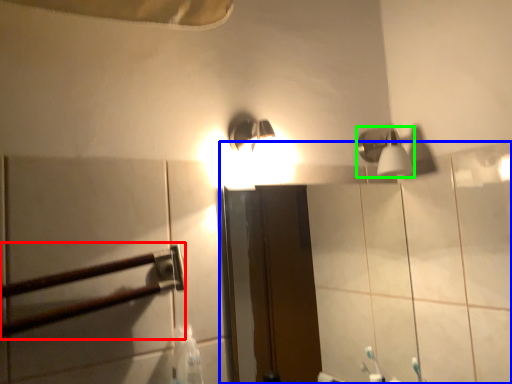
Question: Which object is the farthest from rail (highlighted by a red box)? Choose among these: mirror (highlighted by a blue box) or shower (highlighted by a green box).

Choices:
 (A) mirror
 (B) shower

Answer: (A)